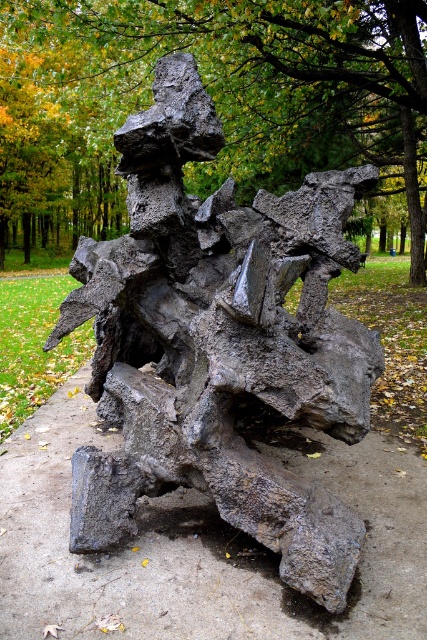
You are a photographer trying to capture the entire view of the green leafy tree at upper center and the rusty metallic sculpture at center. Based on their sizes, which object should you focus on to ensure both are fully visible in your frame?

The green leafy tree at upper center might be wider than the rusty metallic sculpture at center, so you should focus on the green leafy tree at upper center to ensure both are fully visible in your frame.

You are an art student standing in front of the sculpture. You notice two parts of the sculpture labeled as the rusty metal sculpture at center and the rusty metallic sculpture at center. Which one appears closer to you?

The rusty metal sculpture at center appears closer to you because it is further to the viewer than the rusty metallic sculpture at center.